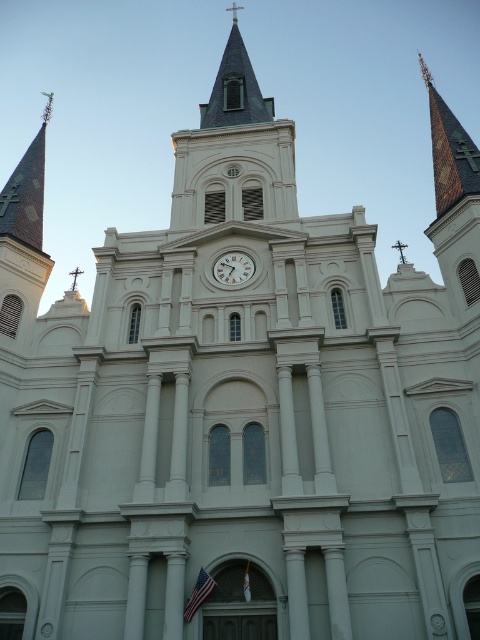
You are an architect evaluating the proportions of the church facade. Which object has a greater width between the golden mosaic spire at upper right and the white glossy clock at center?

The golden mosaic spire at upper right has a greater width than the white glossy clock at center according to the description.

You are standing at the base of the church looking up at its front facade. There is a point marked at coordinates point (435,205). If you have a laser pointer with a range of 400 feet, will you be able to hit that point with your laser pointer?

The point (435,205) is 434.25 feet away from the viewer. Since the laser pointer has a range of 400 feet, it cannot reach that distance. Therefore, you won not be able to hit the point with your laser pointer.

You are an architect planning to install a new decorative element on the church facade. You have two options for placement based on the existing structures. The first option is to place it near the dark gray slate spire at upper center, and the second is near the white glossy clock at center. Considering the widths of these structures, which location would allow for a wider decorative element?

The dark gray slate spire at upper center has a larger width than the white glossy clock at center, so placing the decorative element near the dark gray slate spire at upper center would allow for a wider decorative element.